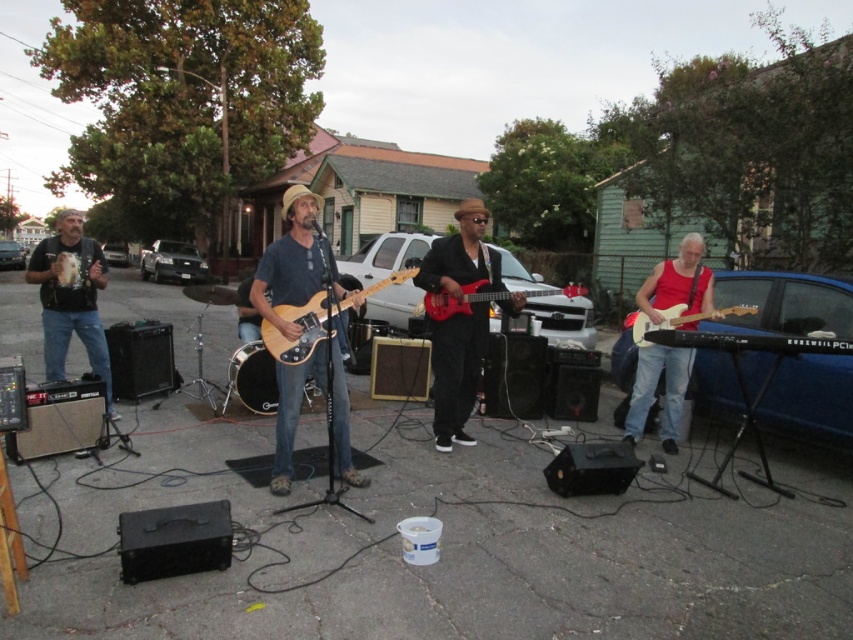
Question: Does shiny red electric guitar at center have a smaller size compared to matte wood electric guitar at center?

Choices:
 (A) no
 (B) yes

Answer: (A)

Question: Can you confirm if shiny red electric guitar at center is bigger than matte wood electric guitar at center?

Choices:
 (A) no
 (B) yes

Answer: (B)

Question: Which object is closer to the camera taking this photo?

Choices:
 (A) red matte guitar at right
 (B) matte wood electric guitar at right

Answer: (B)

Question: Which object is closer to the camera taking this photo?

Choices:
 (A) matte wood electric guitar at center
 (B) glossy electric guitar at center
 (C) brown wood guitar at center

Answer: (A)

Question: Where is matte black guitar at left located in relation to matte wood electric guitar at right in the image?

Choices:
 (A) left
 (B) right

Answer: (A)

Question: Which of the following is the farthest from the observer?

Choices:
 (A) matte wood electric guitar at right
 (B) matte black guitar at left

Answer: (B)